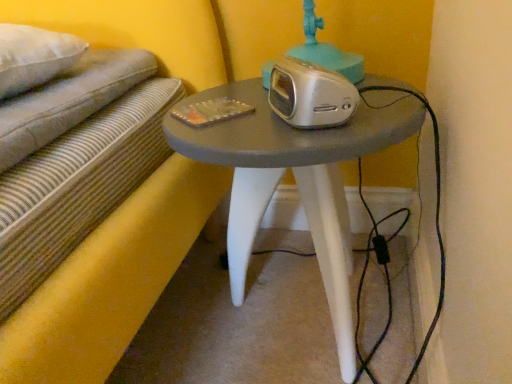
Where is `vacant space underneath matte gray table at center (from a real-world perspective)`? vacant space underneath matte gray table at center (from a real-world perspective) is located at coordinates (294, 309).